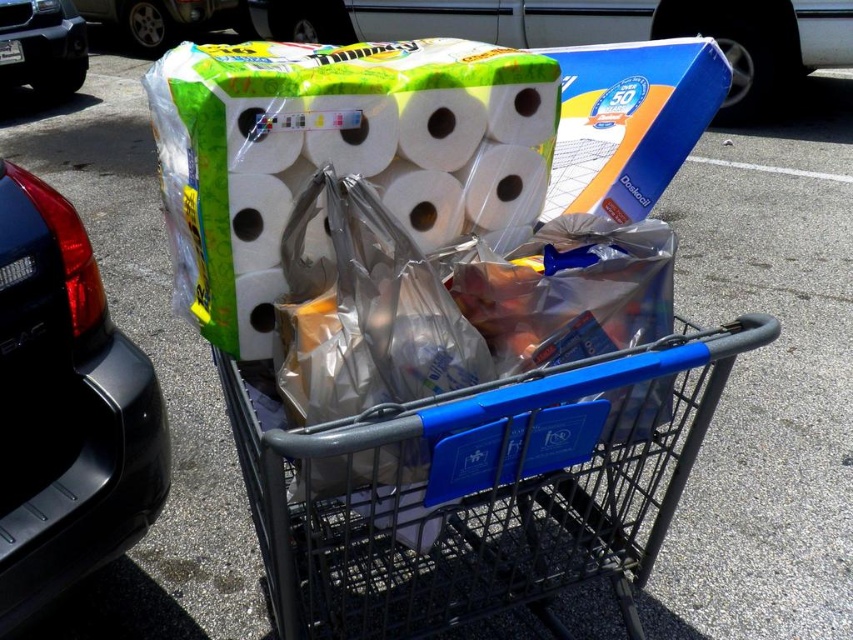
Is white matte toilet paper at center wider than matte green paper towel at upper center?

No, white matte toilet paper at center is not wider than matte green paper towel at upper center.

Image resolution: width=853 pixels, height=640 pixels. What do you see at coordinates (335, 154) in the screenshot?
I see `white matte toilet paper at center` at bounding box center [335, 154].

Locate an element on the screen. The height and width of the screenshot is (640, 853). white matte toilet paper at center is located at coordinates (335, 154).

Which is below, black plastic car at left or matte green paper towel at upper center?

black plastic car at left

Consider the image. Is black plastic car at left above matte green paper towel at upper center?

Incorrect, black plastic car at left is not positioned above matte green paper towel at upper center.

Does point (65, 321) come behind point (573, 12)?

That is False.

Locate an element on the screen. The image size is (853, 640). black plastic car at left is located at coordinates (67, 408).

Is matte green paper towel at upper center taller than shiny silver car at upper left?

Yes, matte green paper towel at upper center is taller than shiny silver car at upper left.

Who is more forward, (x=751, y=120) or (x=74, y=4)?

Point (x=751, y=120)

You are a GUI agent. You are given a task and a screenshot of the screen. Output one action in this format:
    pyautogui.click(x=<x>, y=<y>)
    Task: Click on the matte green paper towel at upper center
    This screenshot has height=640, width=853.
    Given the screenshot: What is the action you would take?
    pyautogui.click(x=598, y=32)